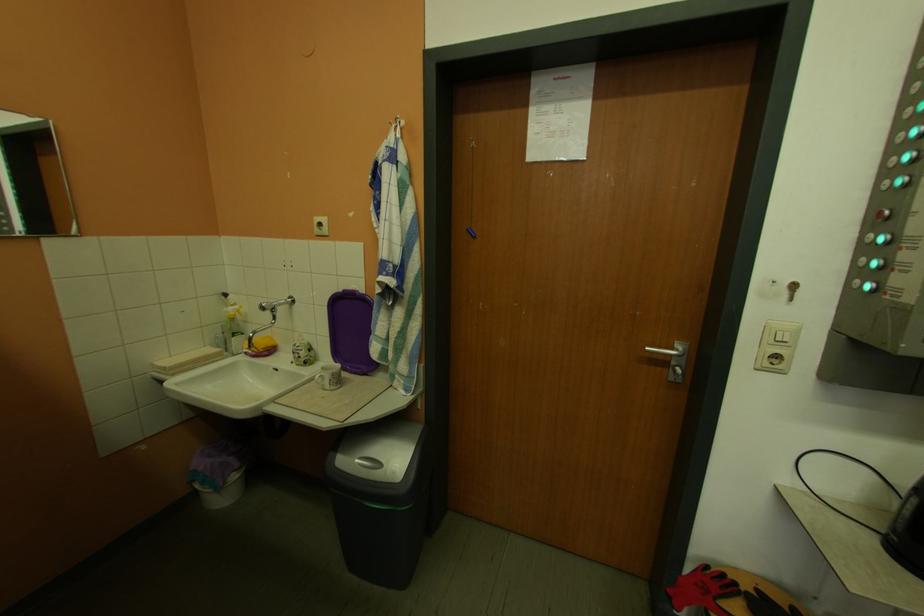
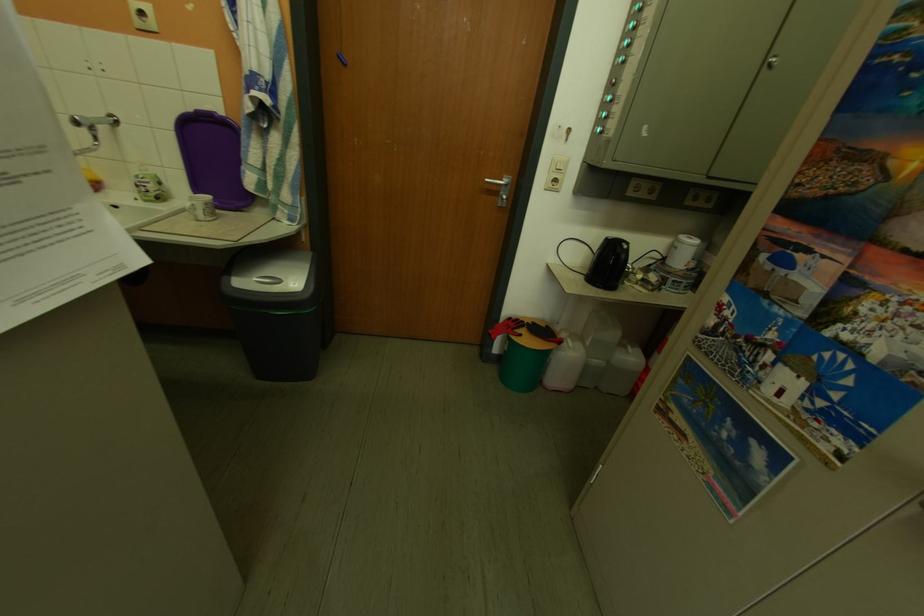
Find the pixel in the second image that matches [335,377] in the first image.

(207, 206)